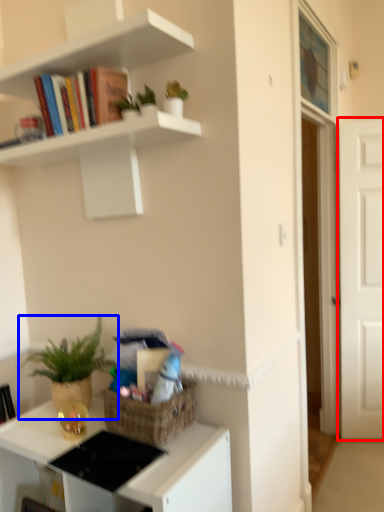
Question: Which object is further to the camera taking this photo, door (highlighted by a red box) or houseplant (highlighted by a blue box)?

Choices:
 (A) door
 (B) houseplant

Answer: (A)